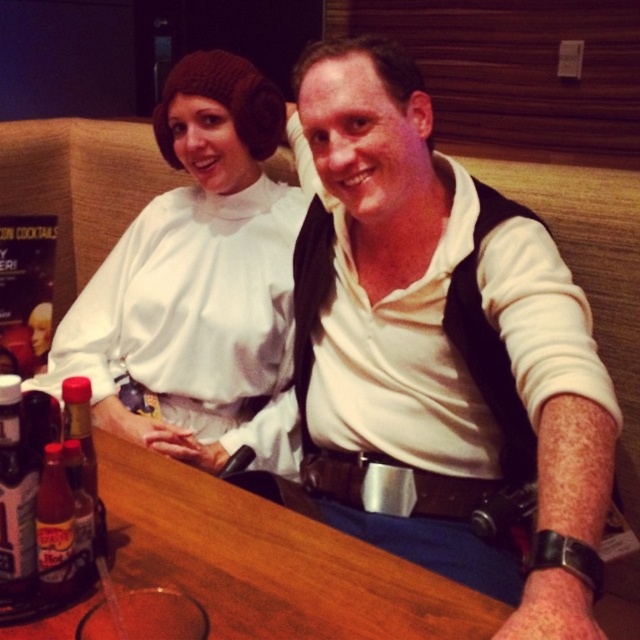
Is translucent plastic bottle at lower left further to the viewer compared to translucent glass bottle at center?

No, it is in front of translucent glass bottle at center.

Is point (28, 522) less distant than point (77, 529)?

Yes, it is.

Is point (10, 442) farther from viewer compared to point (84, 544)?

No, it is not.

Locate an element on the screen. Image resolution: width=640 pixels, height=640 pixels. translucent plastic bottle at lower left is located at coordinates (16, 496).

Is translucent plastic bottle at table left taller than translucent glass bottle at center?

Yes, translucent plastic bottle at table left is taller than translucent glass bottle at center.

In the scene shown: Which is more to the right, translucent plastic bottle at table left or translucent glass bottle at center?

From the viewer's perspective, translucent glass bottle at center appears more on the right side.

Where is `translucent plastic bottle at table left`? translucent plastic bottle at table left is located at coordinates (54, 528).

Who is positioned more to the right, translucent plastic bottle at lower left or translucent plastic bottle at table left?

translucent plastic bottle at table left

Is translucent plastic bottle at lower left below translucent plastic bottle at table left?

No.

Between point (4, 442) and point (60, 497), which one is positioned behind?

The point (60, 497) is more distant.

Locate an element on the screen. The height and width of the screenshot is (640, 640). translucent plastic bottle at lower left is located at coordinates (16, 496).